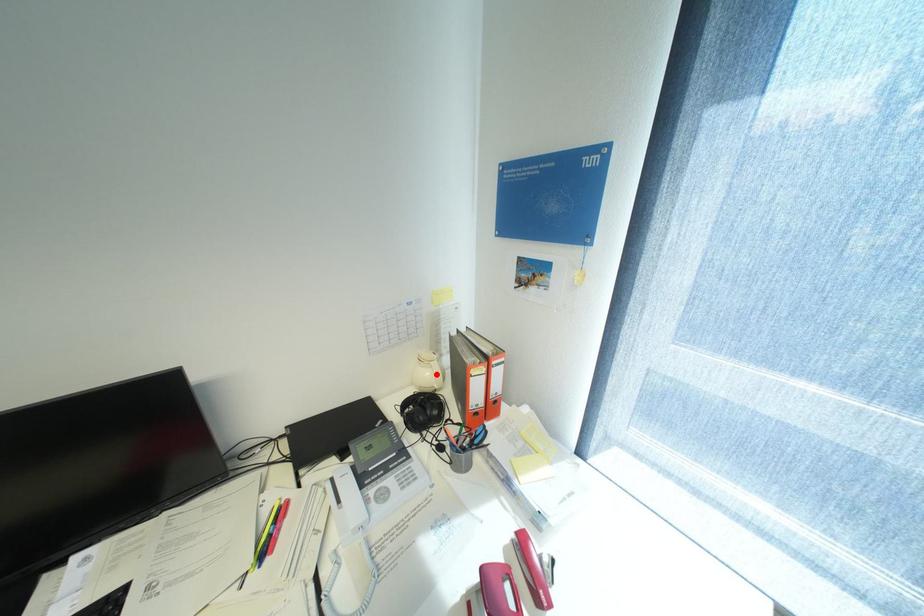
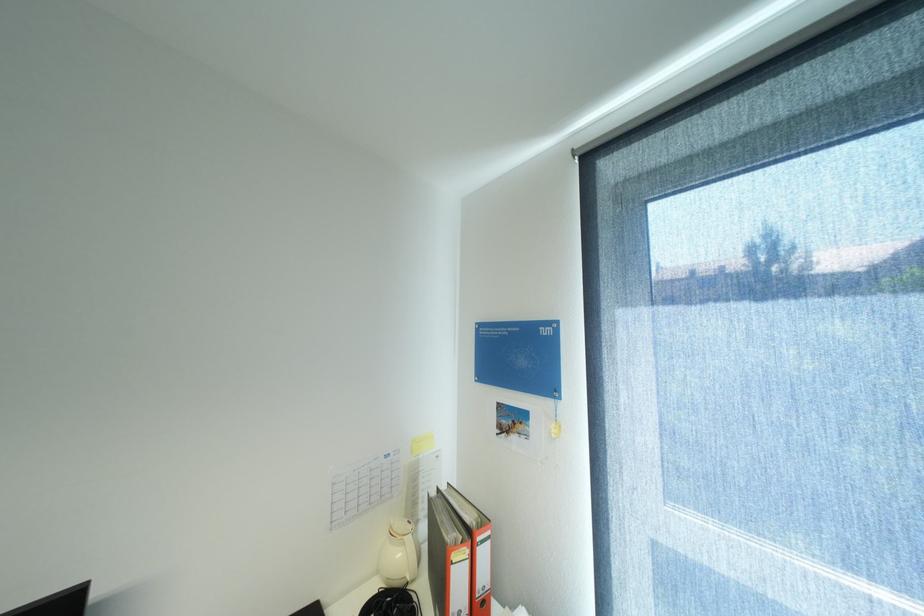
Where in the second image is the point corresponding to the highlighted location from the first image?

(407, 554)